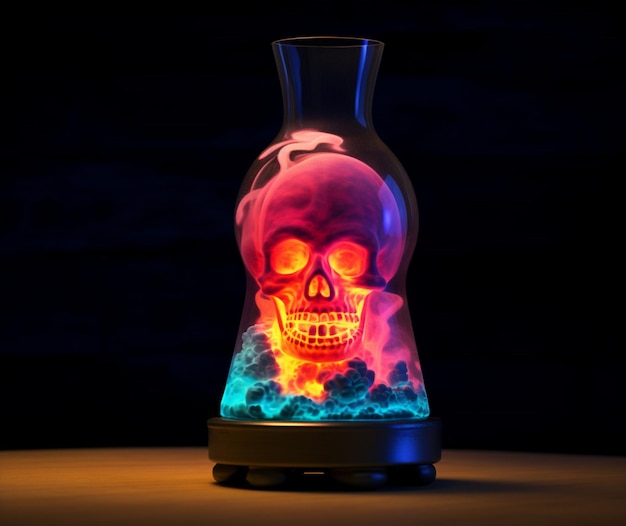
The image size is (626, 526). What are the coordinates of `wood table` in the screenshot? It's located at (124, 479).